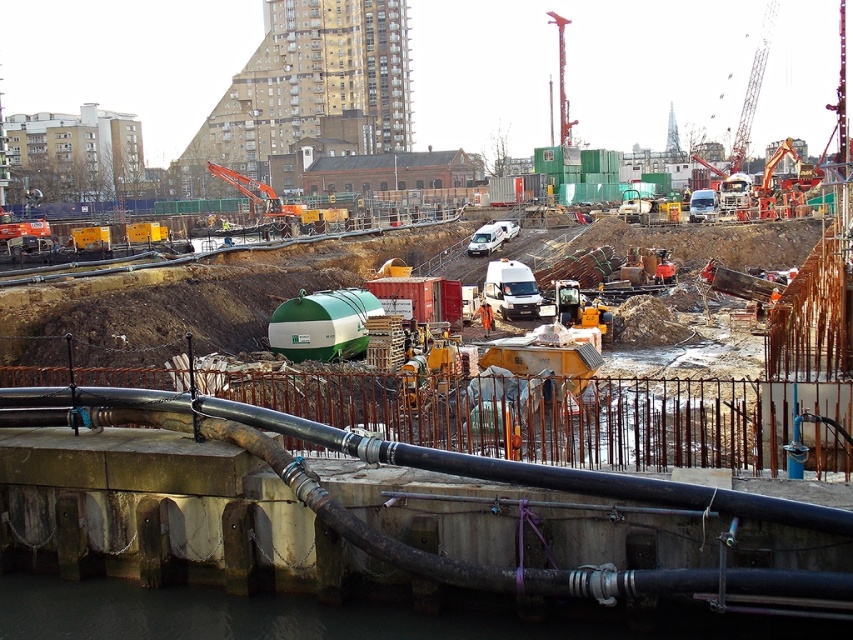
Does yellow metallic train track at center have a lesser height compared to white matte van at center?

No, yellow metallic train track at center is not shorter than white matte van at center.

Which is more to the left, yellow metallic train track at center or white matte van at center?

Positioned to the left is yellow metallic train track at center.

The width and height of the screenshot is (853, 640). Describe the element at coordinates (62, 269) in the screenshot. I see `yellow metallic train track at center` at that location.

You are a GUI agent. You are given a task and a screenshot of the screen. Output one action in this format:
    pyautogui.click(x=<x>, y=<y>)
    Task: Click on the yellow metallic train track at center
    The width and height of the screenshot is (853, 640).
    Given the screenshot: What is the action you would take?
    click(62, 269)

Who is more forward, (154, 492) or (743, 140)?

Point (154, 492) is more forward.

Is green matte tank at center bigger than metallic orange crane at upper right?

No, green matte tank at center is not bigger than metallic orange crane at upper right.

Who is more distant from viewer, (834, 566) or (756, 81)?

Point (756, 81)

Where is `green matte tank at center`? The height and width of the screenshot is (640, 853). green matte tank at center is located at coordinates (383, 515).

Is metallic orange crane at upper right shorter than red metal crane at upper center?

No.

Is metallic orange crane at upper right to the right of red metal crane at upper center from the viewer's perspective?

Yes, metallic orange crane at upper right is to the right of red metal crane at upper center.

Is point (766, 54) closer to viewer compared to point (564, 112)?

No, (766, 54) is behind (564, 112).

What are the coordinates of `metallic orange crane at upper right` in the screenshot? It's located at (752, 88).